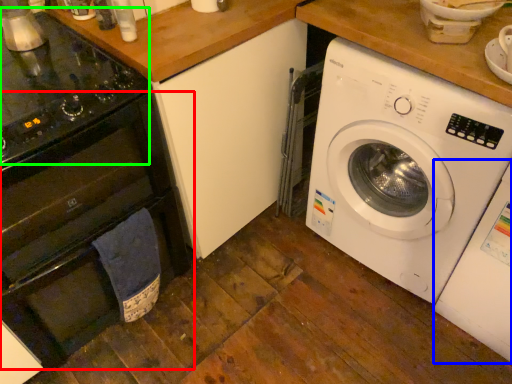
Question: Considering the real-world distances, which object is farthest from oven (highlighted by a red box)? washing machine (highlighted by a blue box) or gas stove (highlighted by a green box)?

Choices:
 (A) washing machine
 (B) gas stove

Answer: (A)